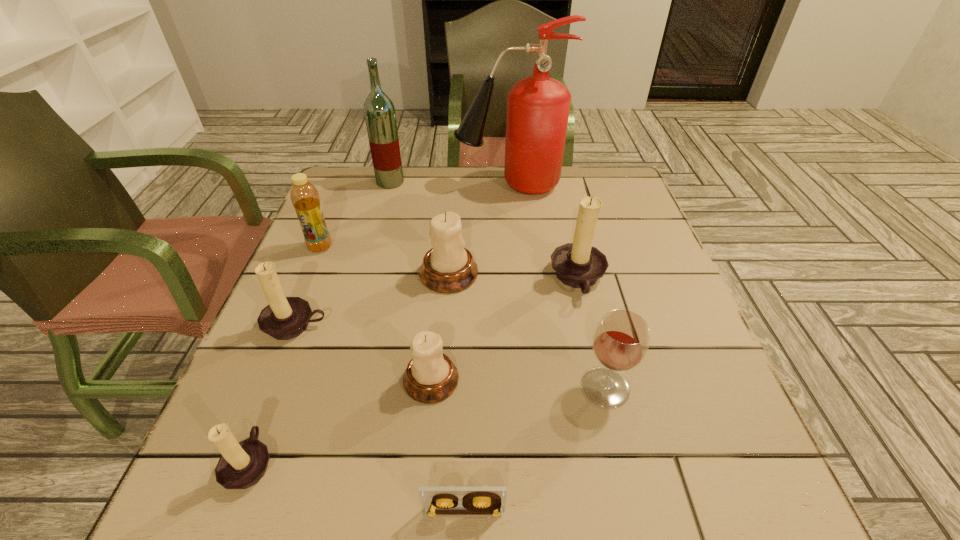
At what (x,y) coordinates should I click in order to perform the action: click on brown candle holder that can be found as the closest to the third farthest candle holder. Please return your answer as a coordinate pair (x, y). Image resolution: width=960 pixels, height=540 pixels. Looking at the image, I should click on (242, 465).

Where is `brown candle holder that stands as the third closest to the red wineglass`? This screenshot has width=960, height=540. brown candle holder that stands as the third closest to the red wineglass is located at coordinates (242, 465).

Identify the location of free space that satisfies the following two spatial constraints: 1. with the nozzle aimed from the wineglass; 2. on the left side of the fire extinguisher. click(527, 387).

Locate an element on the screen. The image size is (960, 540). vacant space that satisfies the following two spatial constraints: 1. on the back side of the farther white candle holder; 2. on the left side of the nearer white candle holder is located at coordinates (442, 274).

Locate an element on the screen. The height and width of the screenshot is (540, 960). free spot that satisfies the following two spatial constraints: 1. on the wick of the smaller white candle holder; 2. on the left side of the second biggest brown candle holder is located at coordinates (275, 380).

In order to click on vacant space that satisfies the following two spatial constraints: 1. with the nozzle aimed from the fire extinguisher; 2. on the wick of the second biggest brown candle holder in this screenshot , I will do `click(522, 325)`.

The height and width of the screenshot is (540, 960). What are the coordinates of `vacant point that satisfies the following two spatial constraints: 1. on the front side of the green liquor; 2. on the left side of the nearer white candle holder` in the screenshot? It's located at (334, 380).

Where is `vacant position in the image that satisfies the following two spatial constraints: 1. on the wick of the wineglass; 2. on the right side of the farthest brown candle holder`? The image size is (960, 540). vacant position in the image that satisfies the following two spatial constraints: 1. on the wick of the wineglass; 2. on the right side of the farthest brown candle holder is located at coordinates (604, 387).